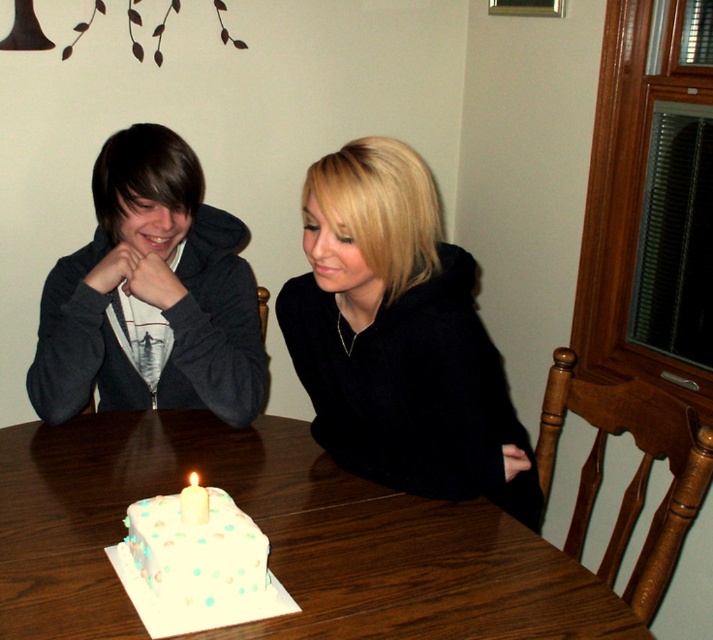
Who is positioned more to the left, white wooden table at center or matte black hoodie at left?

Positioned to the left is matte black hoodie at left.

Does white wooden table at center appear on the left side of matte black hoodie at left?

No, white wooden table at center is not to the left of matte black hoodie at left.

Is point (265, 435) farther from camera compared to point (158, 333)?

No, it is not.

The width and height of the screenshot is (713, 640). Find the location of `white wooden table at center`. white wooden table at center is located at coordinates (276, 538).

Image resolution: width=713 pixels, height=640 pixels. Describe the element at coordinates (399, 337) in the screenshot. I see `black fuzzy sweater at center` at that location.

Is black fuzzy sweater at center below white frosted cake at center?

Incorrect, black fuzzy sweater at center is not positioned below white frosted cake at center.

Identify the location of black fuzzy sweater at center. (399, 337).

Is black fuzzy sweater at center closer to camera compared to matte black hoodie at left?

Yes, it is.

Does point (329, 188) come behind point (86, 304)?

No, it is in front of (86, 304).

Where is `black fuzzy sweater at center`? black fuzzy sweater at center is located at coordinates (399, 337).